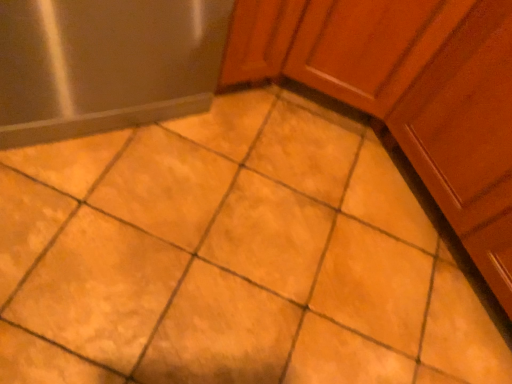
You are a GUI agent. You are given a task and a screenshot of the screen. Output one action in this format:
    pyautogui.click(x=<x>, y=<y>)
    Task: Click on the free spot below matte wood cabinet at upper right (from a real-world perspective)
    This screenshot has height=384, width=512.
    Given the screenshot: What is the action you would take?
    pyautogui.click(x=376, y=242)